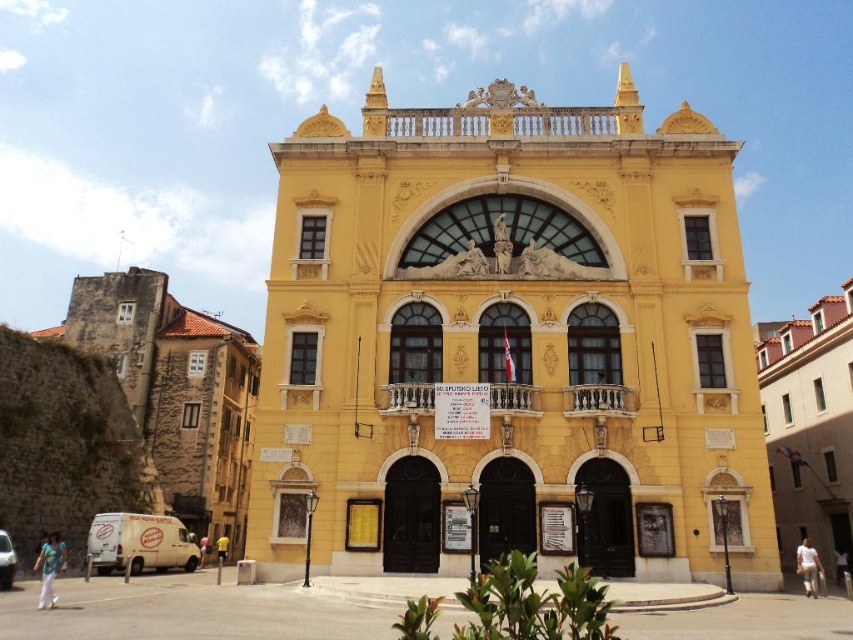
You are an architect analyzing the facade of a building complex. You observe the brown stone wall at left and the yellow matte building at right. Which structure has a taller vertical dimension?

The brown stone wall at left has a greater height compared to the yellow matte building at right, so the brown stone wall at left is taller.

You are standing in the middle of a European town square. You see a brown stone wall at left and a yellow matte building at right. If you want to walk to the closest one, which should you choose?

The brown stone wall at left is 64.09 meters away from the yellow matte building at right. Therefore, the yellow matte building at right is closer to you than the brown stone wall at left, so you should walk to the yellow matte building at right.